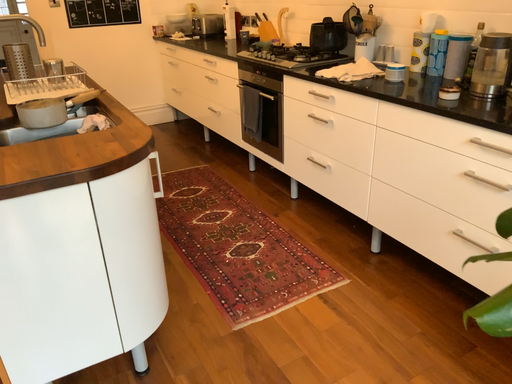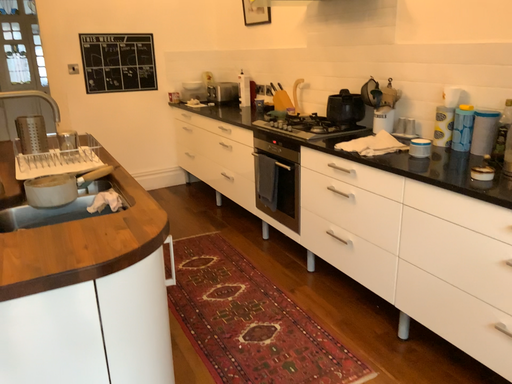
Question: Which way did the camera rotate in the video?

Choices:
 (A) rotated downward
 (B) rotated upward

Answer: (B)